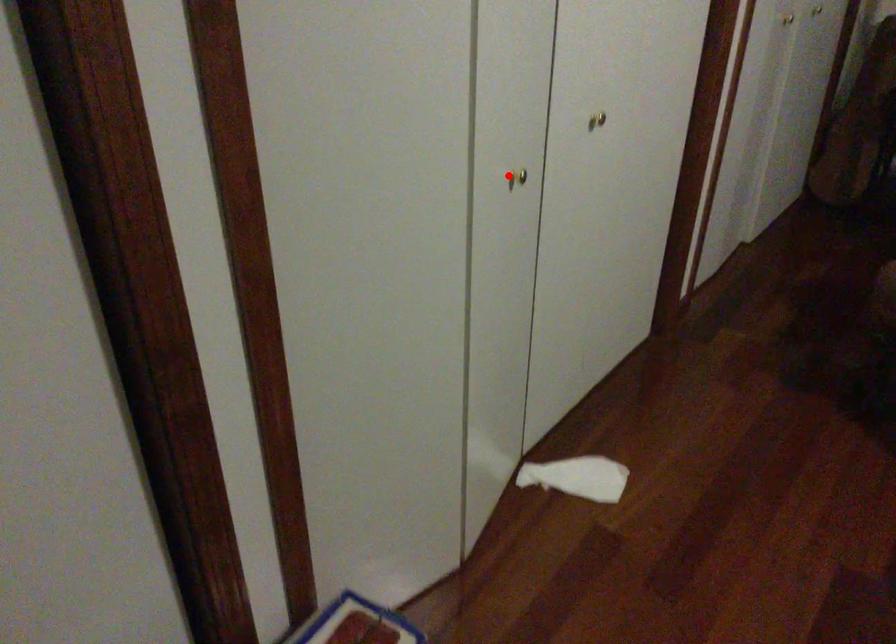
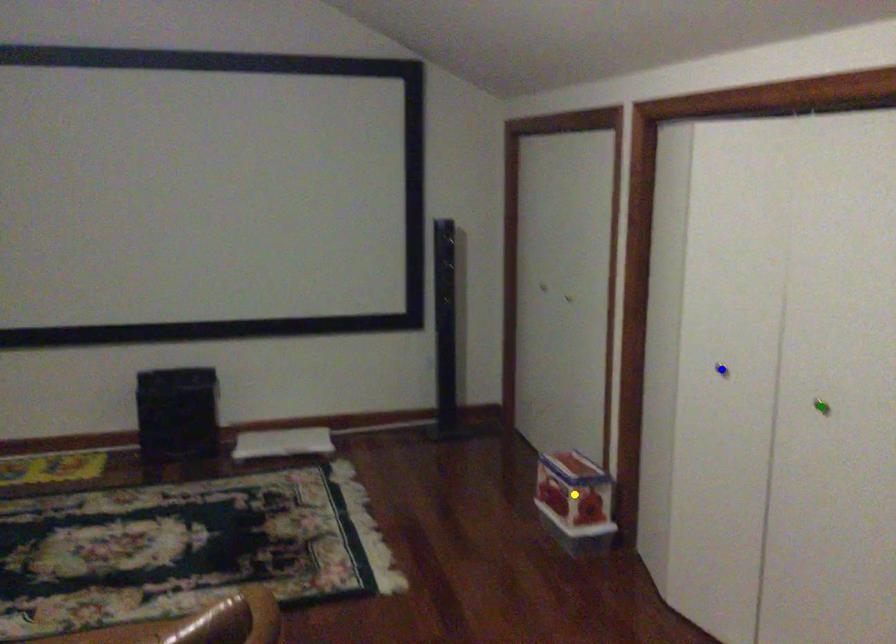
Question: I am providing you with two images of the same scene from different viewpoints. A red point is marked on the first image. You are given multiple points on the second image. Which point in image 2 represents the same 3d spot as the red point in image 1?

Choices:
 (A) green point
 (B) blue point
 (C) yellow point

Answer: (B)